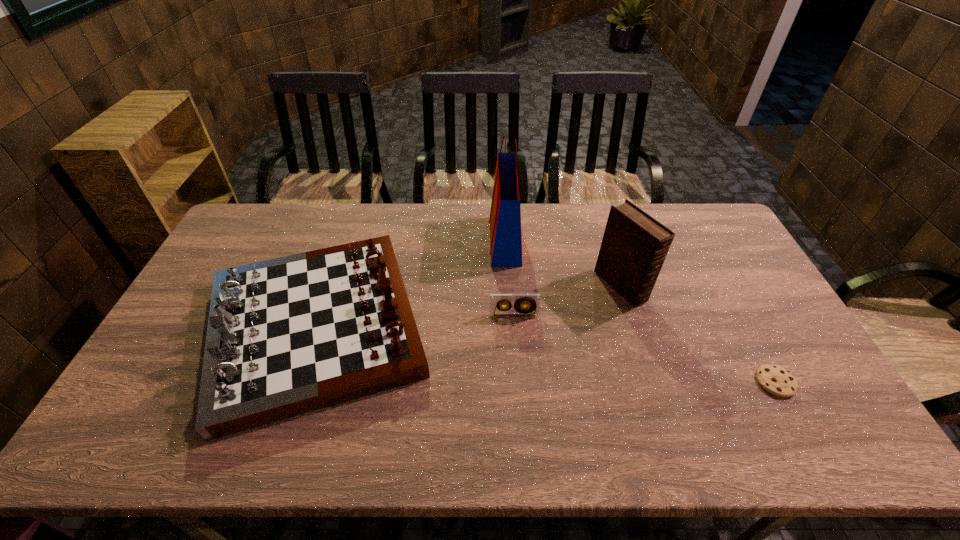
This screenshot has height=540, width=960. What are the coordinates of `the tallest object` in the screenshot? It's located at (505, 216).

Locate an element on the screen. This screenshot has height=540, width=960. the fourth object from left to right is located at coordinates (634, 246).

You are a GUI agent. You are given a task and a screenshot of the screen. Output one action in this format:
    pyautogui.click(x=<x>, y=<y>)
    Task: Click on the fourth shortest object
    This screenshot has width=960, height=540.
    Given the screenshot: What is the action you would take?
    pyautogui.click(x=634, y=246)

You are a GUI agent. You are given a task and a screenshot of the screen. Output one action in this format:
    pyautogui.click(x=<x>, y=<y>)
    Task: Click on the leftmost object
    The height and width of the screenshot is (540, 960).
    Given the screenshot: What is the action you would take?
    pyautogui.click(x=287, y=336)

At what (x,y) coordinates should I click in order to perform the action: click on gameboard. Please return your answer as a coordinate pair (x, y). The width and height of the screenshot is (960, 540). Looking at the image, I should click on pos(287,336).

Image resolution: width=960 pixels, height=540 pixels. In order to click on videotape in this screenshot , I will do `click(497, 301)`.

At what (x,y) coordinates should I click in order to perform the action: click on the shortest object. Please return your answer as a coordinate pair (x, y). Looking at the image, I should click on (776, 380).

Image resolution: width=960 pixels, height=540 pixels. I want to click on the rightmost object, so click(776, 380).

This screenshot has width=960, height=540. What are the coordinates of `free region located 0.290m on the handle side of the shopping bag` in the screenshot? It's located at (406, 241).

Where is `blank space located on the handle side of the shopping bag`? The width and height of the screenshot is (960, 540). blank space located on the handle side of the shopping bag is located at coordinates (406, 241).